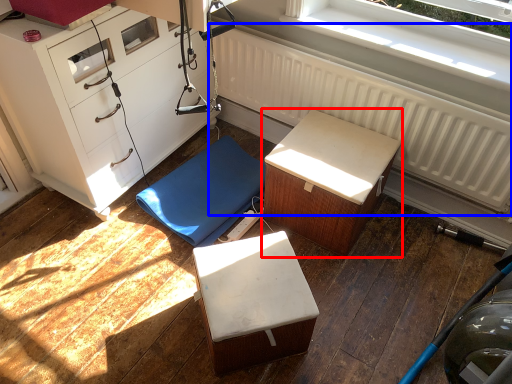
Question: Among these objects, which one is nearest to the camera, furniture (highlighted by a red box) or radiator (highlighted by a blue box)?

Choices:
 (A) furniture
 (B) radiator

Answer: (B)